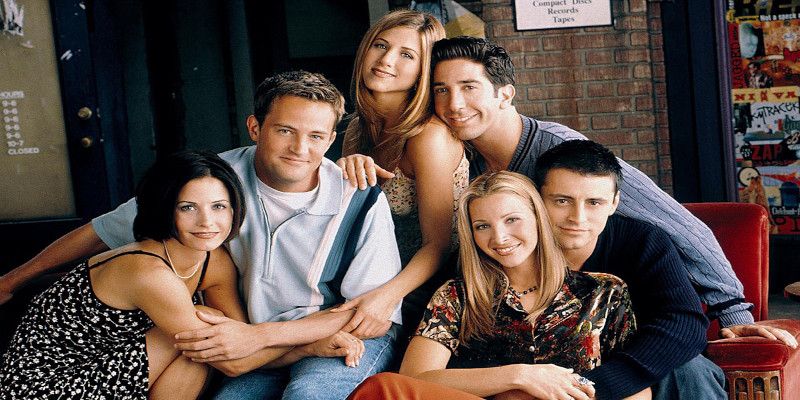
Find the location of `brick wall`. brick wall is located at coordinates (588, 79).